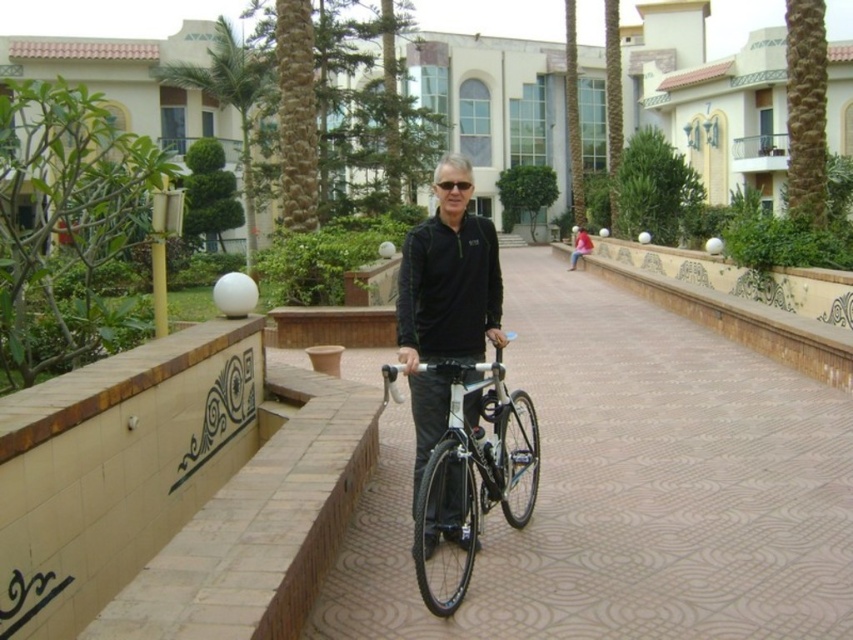
In the scene shown: Is white stucco building at upper center bigger than shiny metallic bicycle at center?

Yes, white stucco building at upper center is bigger than shiny metallic bicycle at center.

Is point (763, 65) positioned after point (473, 392)?

Yes.

Is point (680, 144) behind point (495, 477)?

Yes.

Image resolution: width=853 pixels, height=640 pixels. Identify the location of white stucco building at upper center. (728, 116).

Does shiny metallic bicycle at center appear under black plastic sunglasses at center?

Yes.

Who is more distant from viewer, (505, 394) or (438, 180)?

The point (438, 180) is behind.

Identify the location of shiny metallic bicycle at center. (474, 467).

Can you confirm if black matte jacket at center is positioned to the right of black plastic sunglasses at center?

In fact, black matte jacket at center is to the left of black plastic sunglasses at center.

Is the position of black matte jacket at center less distant than that of black plastic sunglasses at center?

Yes, it is in front of black plastic sunglasses at center.

Locate an element on the screen. black matte jacket at center is located at coordinates (445, 308).